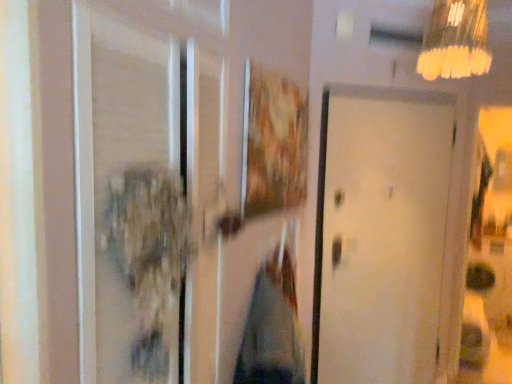
Question: Is yellow frosted glass lampshade at upper right shorter than transparent glass screen door at left?

Choices:
 (A) no
 (B) yes

Answer: (B)

Question: Does yellow frosted glass lampshade at upper right appear on the right side of transparent glass screen door at left?

Choices:
 (A) yes
 (B) no

Answer: (A)

Question: Is yellow frosted glass lampshade at upper right positioned before transparent glass screen door at left?

Choices:
 (A) yes
 (B) no

Answer: (B)

Question: Are yellow frosted glass lampshade at upper right and transparent glass screen door at left far apart?

Choices:
 (A) no
 (B) yes

Answer: (B)

Question: From the image's perspective, is yellow frosted glass lampshade at upper right over transparent glass screen door at left?

Choices:
 (A) yes
 (B) no

Answer: (A)

Question: Does yellow frosted glass lampshade at upper right touch transparent glass screen door at left?

Choices:
 (A) no
 (B) yes

Answer: (A)

Question: Is wooden textured picture frame at center further to camera compared to yellow frosted glass lampshade at upper right?

Choices:
 (A) no
 (B) yes

Answer: (A)

Question: Does wooden textured picture frame at center have a lesser width compared to yellow frosted glass lampshade at upper right?

Choices:
 (A) no
 (B) yes

Answer: (B)

Question: Could you tell me if wooden textured picture frame at center is turned towards yellow frosted glass lampshade at upper right?

Choices:
 (A) yes
 (B) no

Answer: (B)

Question: From a real-world perspective, is wooden textured picture frame at center on top of yellow frosted glass lampshade at upper right?

Choices:
 (A) no
 (B) yes

Answer: (A)

Question: From a real-world perspective, is wooden textured picture frame at center below yellow frosted glass lampshade at upper right?

Choices:
 (A) no
 (B) yes

Answer: (B)

Question: Can you confirm if wooden textured picture frame at center is bigger than yellow frosted glass lampshade at upper right?

Choices:
 (A) yes
 (B) no

Answer: (B)

Question: Is transparent glass screen door at left facing towards yellow frosted glass lampshade at upper right?

Choices:
 (A) no
 (B) yes

Answer: (A)